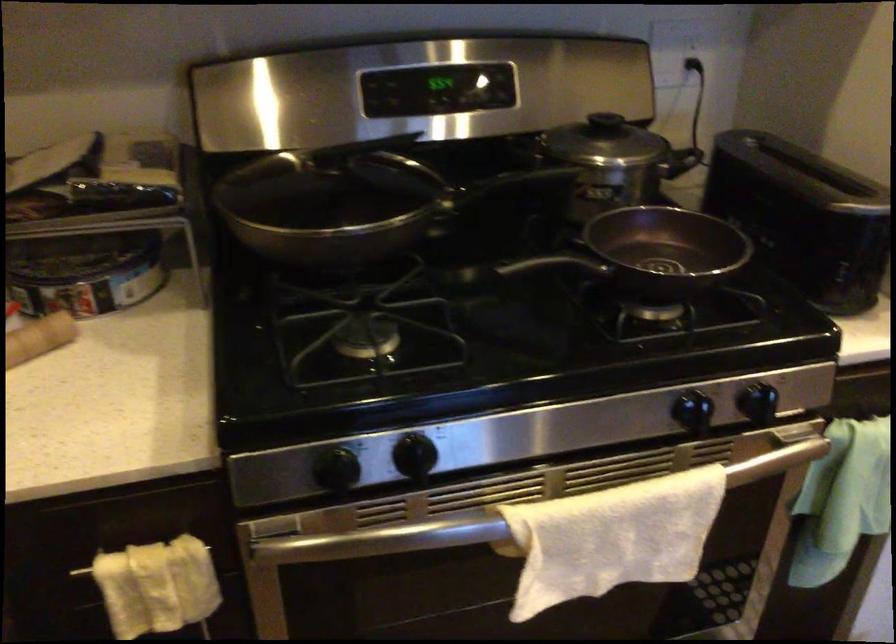
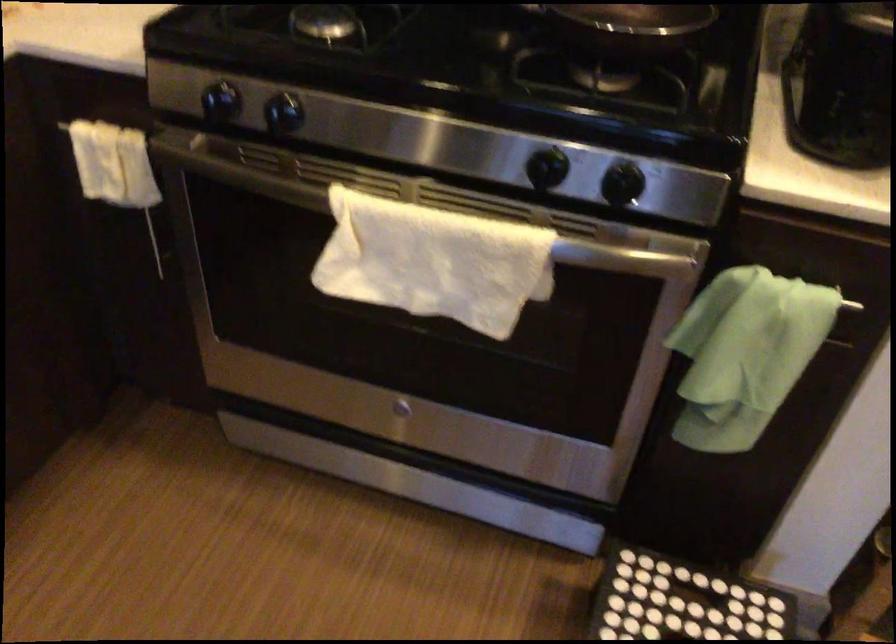
Where in the second image is the point corresponding to point 366,544 from the first image?

(235, 172)